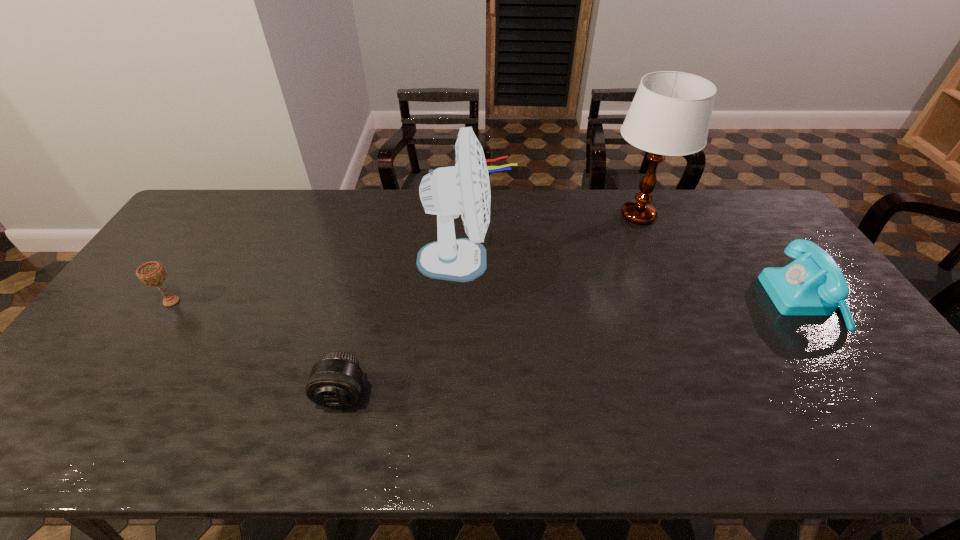
Image resolution: width=960 pixels, height=540 pixels. I want to click on the second object from right to left, so click(670, 114).

You are a GUI agent. You are given a task and a screenshot of the screen. Output one action in this format:
    pyautogui.click(x=<x>, y=<y>)
    Task: Click on the third object from right to left
    The height and width of the screenshot is (540, 960).
    Given the screenshot: What is the action you would take?
    pyautogui.click(x=447, y=192)

Locate an element on the screen. telephone is located at coordinates coord(812,285).

Find the location of a particular element. This screenshot has width=960, height=540. the leftmost object is located at coordinates (152, 273).

Locate an element on the screen. The image size is (960, 540). the nearest object is located at coordinates (335, 381).

Identify the location of telephoto lens. (335, 381).

Locate an element on the screen. The width and height of the screenshot is (960, 540). vacant position located 0.300m on the right of the second object from right to left is located at coordinates (759, 215).

Where is `free spot located 0.110m on the grille of the fan`? The image size is (960, 540). free spot located 0.110m on the grille of the fan is located at coordinates (547, 260).

This screenshot has width=960, height=540. I want to click on vacant space situated 0.080m on the dial of the telephone, so click(x=744, y=301).

Find the location of a particular element. free space located 0.360m on the dial of the telephone is located at coordinates (647, 301).